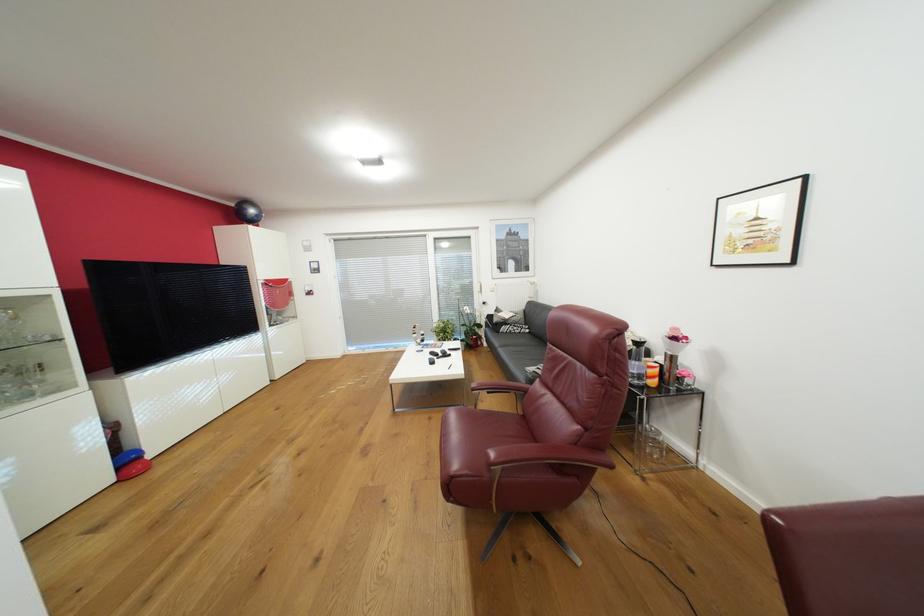
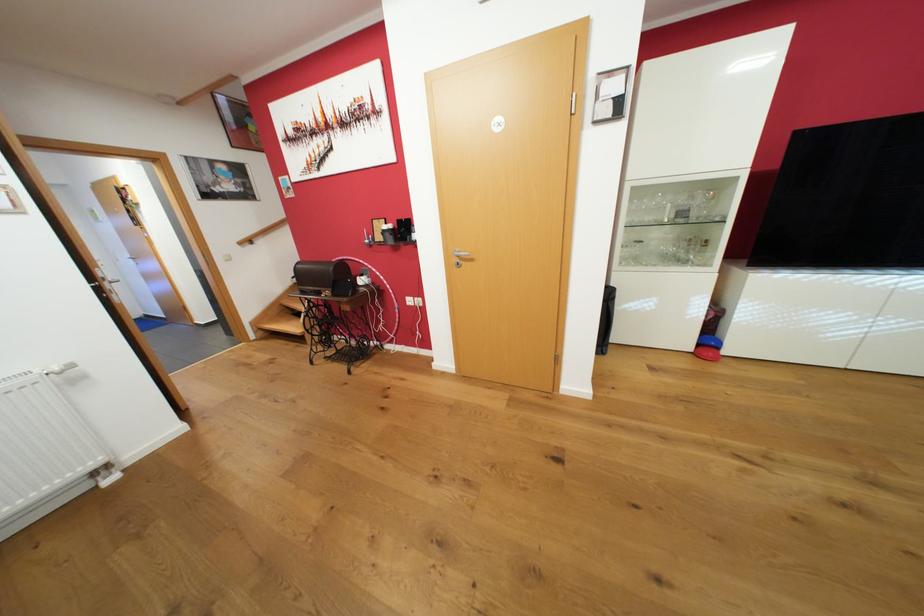
The images are taken continuously from a first-person perspective. In which direction is your viewpoint rotating?

The camera's rotation is toward left-down.